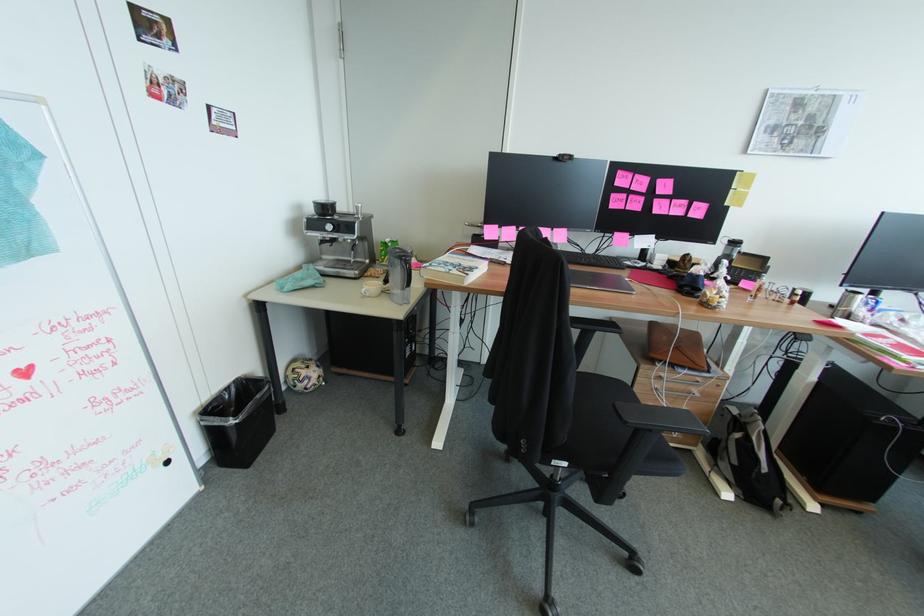
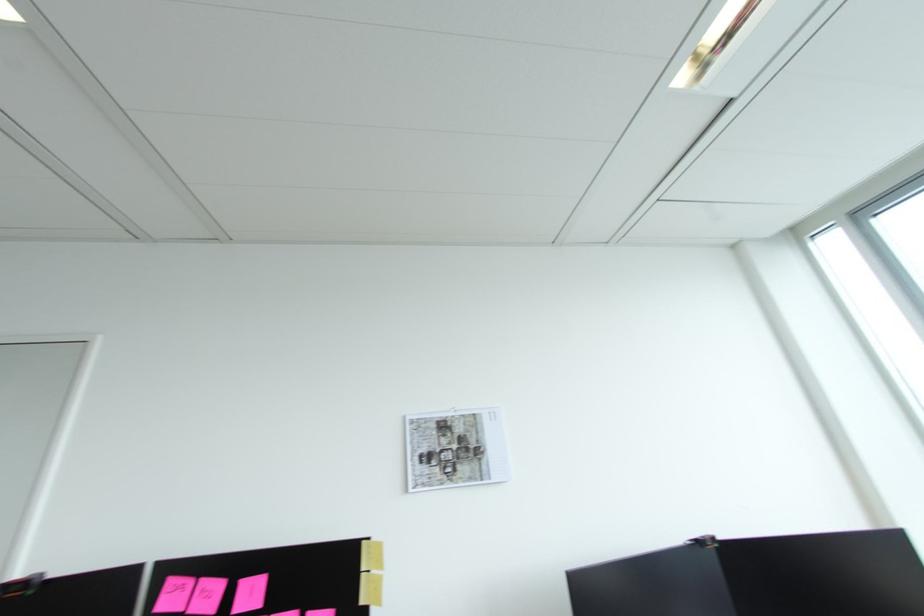
Locate, in the second image, the point that corresponds to pixel 806 122 in the first image.

(459, 446)